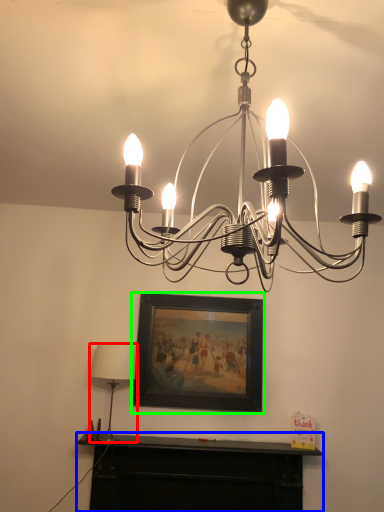
Question: Based on their relative distances, which object is farther from lamp (highlighted by a red box)? Choose from furniture (highlighted by a blue box) and picture frame (highlighted by a green box).

Choices:
 (A) furniture
 (B) picture frame

Answer: (A)